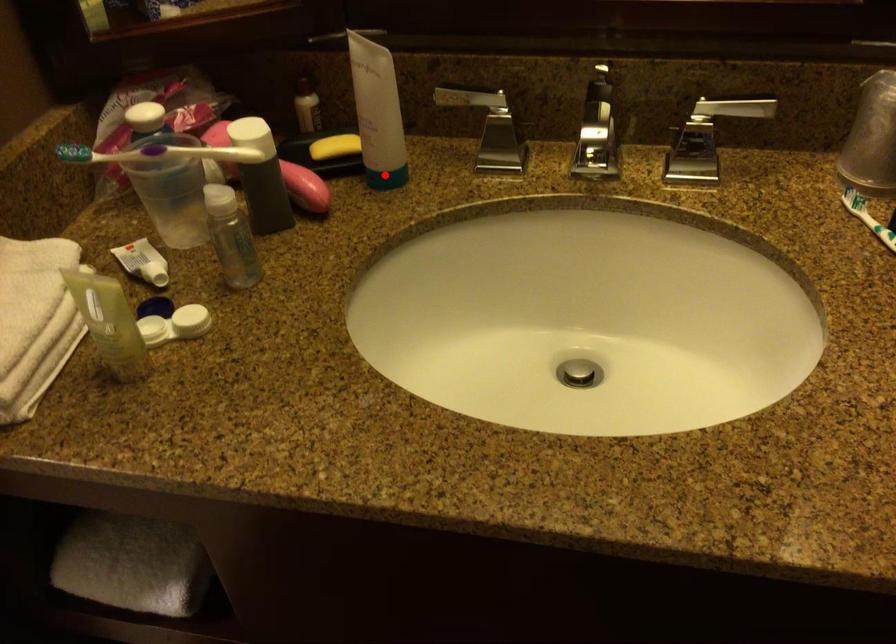
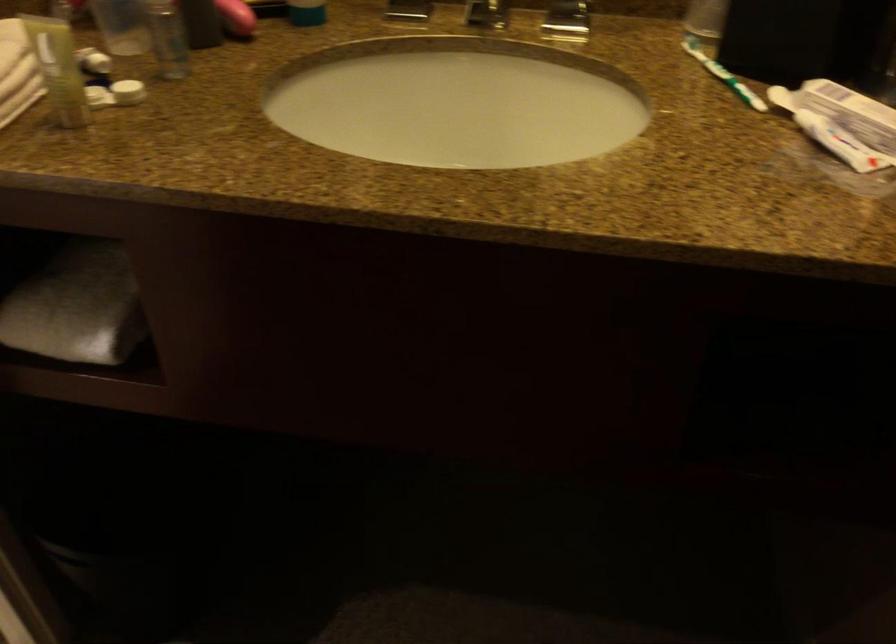
Find the pixel in the second image that matches the highlighted location in the first image.

(306, 13)